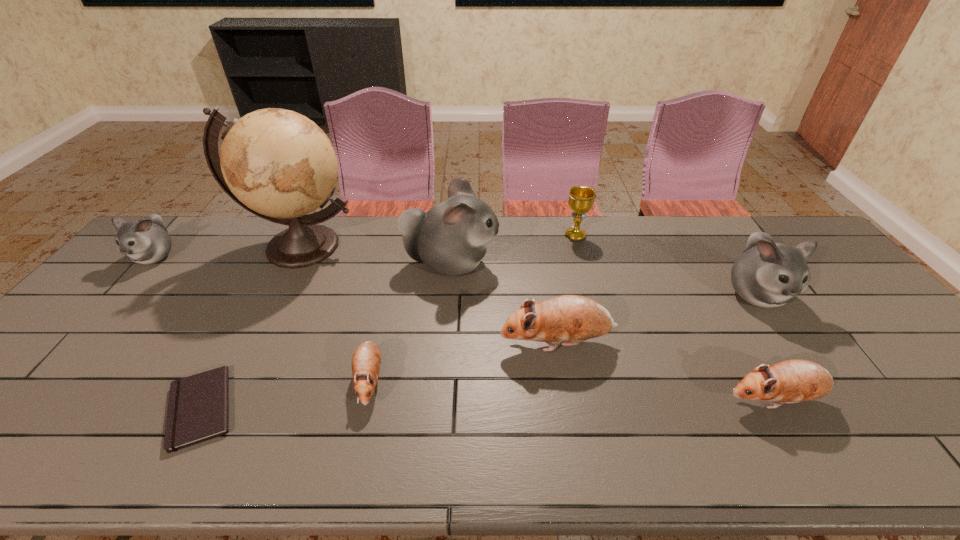
Image resolution: width=960 pixels, height=540 pixels. I want to click on brown hamster that stands as the closest to the fifth shortest hamster, so click(792, 381).

The width and height of the screenshot is (960, 540). I want to click on vacant position in the image that satisfies the following two spatial constraints: 1. on the face of the second white hamster from right to left; 2. at the face of the shortest hamster, so click(x=441, y=381).

Where is `vacant region that satisfies the following two spatial constraints: 1. on the face of the second tallest object; 2. at the face of the leftmost brown hamster`? Image resolution: width=960 pixels, height=540 pixels. vacant region that satisfies the following two spatial constraints: 1. on the face of the second tallest object; 2. at the face of the leftmost brown hamster is located at coordinates (441, 381).

The image size is (960, 540). I want to click on free location that satisfies the following two spatial constraints: 1. at the face of the second brown hamster from left to right; 2. at the face of the second shortest object, so click(564, 381).

The width and height of the screenshot is (960, 540). I want to click on vacant region that satisfies the following two spatial constraints: 1. on the face of the checkbook; 2. on the right side of the leftmost hamster, so click(19, 408).